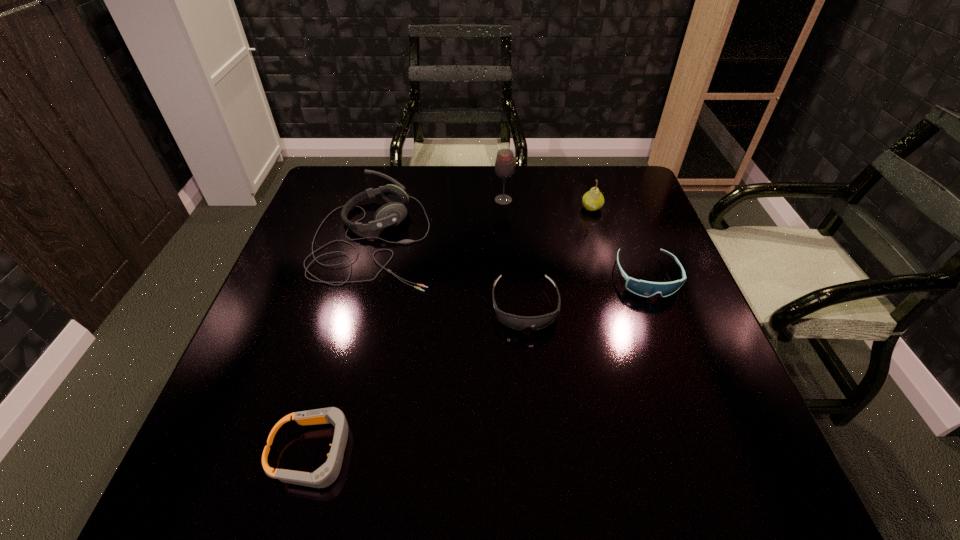
Locate an element on the screen. The height and width of the screenshot is (540, 960). vacant area that lies between the headset and the glass drink container is located at coordinates (439, 220).

Where is `blank region between the leftmost goggles and the pear`? Image resolution: width=960 pixels, height=540 pixels. blank region between the leftmost goggles and the pear is located at coordinates (453, 330).

Where is `free space between the glass drink container and the leftmost goggles`? This screenshot has height=540, width=960. free space between the glass drink container and the leftmost goggles is located at coordinates (409, 327).

Image resolution: width=960 pixels, height=540 pixels. I want to click on free space that is in between the pear and the tallest object, so click(x=547, y=204).

This screenshot has width=960, height=540. I want to click on free spot between the leftmost goggles and the glass drink container, so click(409, 327).

The width and height of the screenshot is (960, 540). In order to click on vacant point located between the second goggles from right to left and the pear in this screenshot , I will do `click(559, 257)`.

At what (x,y) coordinates should I click in order to perform the action: click on free space that is in between the rightmost goggles and the second goggles from right to left. Please return your answer as a coordinate pair (x, y). The image size is (960, 540). Looking at the image, I should click on (586, 292).

The image size is (960, 540). I want to click on empty space between the nearest object and the second goggles from right to left, so click(420, 380).

The width and height of the screenshot is (960, 540). Find the location of `vacant space that's between the tallest object and the second goggles from right to left`. vacant space that's between the tallest object and the second goggles from right to left is located at coordinates (515, 253).

Identify which object is the third nearest to the second goggles from right to left. Please provide its 2D coordinates. Your answer should be formatted as a tuple, i.e. [(x, y)], where the tuple contains the x and y coordinates of a point satisfying the conditions above.

[(593, 200)]